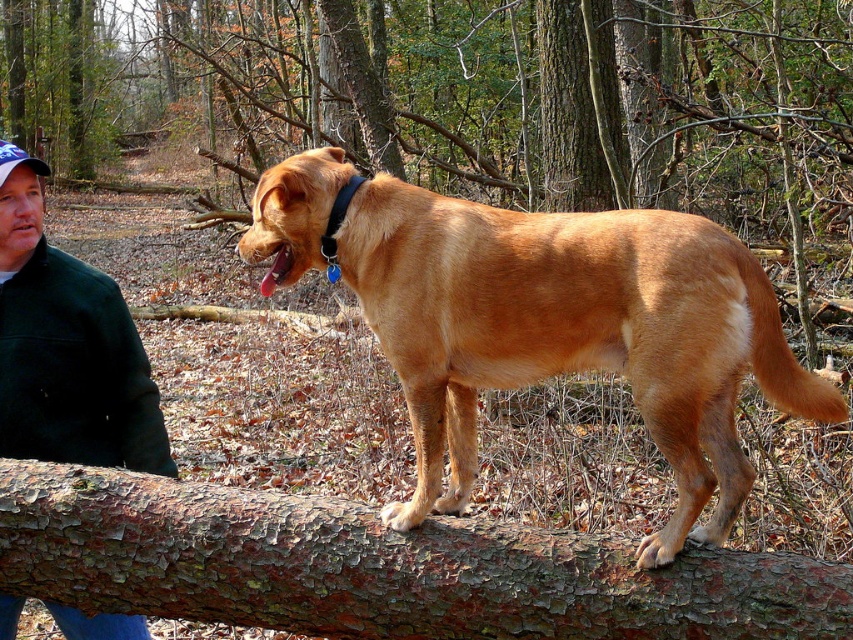
Between brown rough bark tree trunk at center and brown rough bark at center, which one is positioned lower?

brown rough bark at center

Does point (140, 148) lie in front of point (360, 504)?

No, it is not.

Image resolution: width=853 pixels, height=640 pixels. Describe the element at coordinates (477, 99) in the screenshot. I see `brown rough bark tree trunk at center` at that location.

Identify the location of brown rough bark tree trunk at center. (477, 99).

Which is behind, point (120, 486) or point (73, 356)?

The point (73, 356) is behind.

Who is positioned more to the right, brown rough bark at center or green fleece jacket at left?

Positioned to the right is brown rough bark at center.

At what (x,y) coordinates should I click in order to perform the action: click on brown rough bark at center. Please return your answer as a coordinate pair (x, y). The height and width of the screenshot is (640, 853). Looking at the image, I should click on (378, 566).

Does brown rough bark tree trunk at center lie in front of golden fur dog at center?

No, brown rough bark tree trunk at center is further to the viewer.

Does brown rough bark tree trunk at center have a greater width compared to golden fur dog at center?

Yes.

Which is behind, point (630, 88) or point (306, 244)?

Point (630, 88)

Locate an element on the screen. The height and width of the screenshot is (640, 853). brown rough bark tree trunk at center is located at coordinates (477, 99).